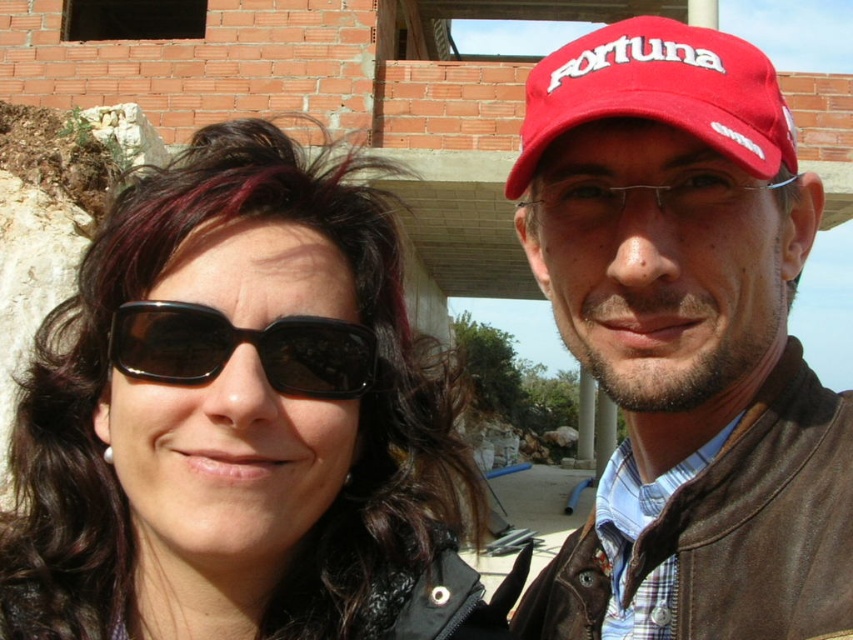
Can you confirm if red fabric cap at upper right is positioned above black reflective sunglasses at center?

Correct, red fabric cap at upper right is located above black reflective sunglasses at center.

Who is higher up, red fabric cap at upper right or black reflective sunglasses at center?

red fabric cap at upper right is above.

This screenshot has width=853, height=640. Find the location of `red fabric cap at upper right`. red fabric cap at upper right is located at coordinates (659, 92).

Locate an element on the screen. The width and height of the screenshot is (853, 640). matte leather jacket at right is located at coordinates (685, 340).

Can you confirm if matte leather jacket at right is taller than red fabric cap at upper right?

No, matte leather jacket at right is not taller than red fabric cap at upper right.

Measure the distance between matte leather jacket at right and camera.

The distance of matte leather jacket at right from camera is 8.69 meters.

This screenshot has height=640, width=853. I want to click on matte leather jacket at right, so click(x=685, y=340).

Image resolution: width=853 pixels, height=640 pixels. What do you see at coordinates (685, 340) in the screenshot? I see `matte leather jacket at right` at bounding box center [685, 340].

Which is more to the right, matte leather jacket at right or black reflective sunglasses at center?

matte leather jacket at right is more to the right.

You are a GUI agent. You are given a task and a screenshot of the screen. Output one action in this format:
    pyautogui.click(x=<x>, y=<y>)
    Task: Click on the matte leather jacket at right
    Image resolution: width=853 pixels, height=640 pixels.
    Given the screenshot: What is the action you would take?
    pyautogui.click(x=685, y=340)